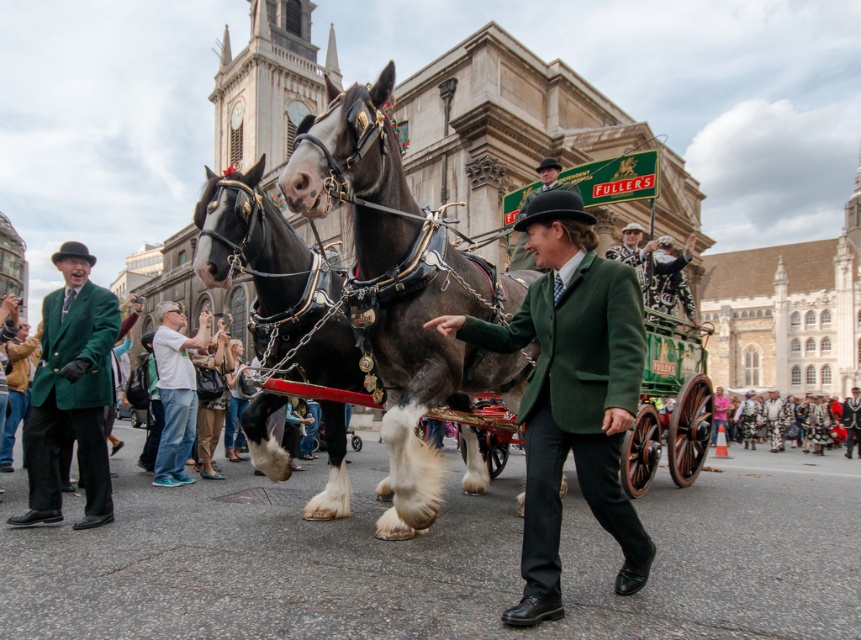
Question: From the image, what is the correct spatial relationship of green velvet jacket at center in relation to green woolen blazer at left?

Choices:
 (A) left
 (B) right

Answer: (B)

Question: In this image, where is green woolen blazer at left located relative to green woolen coat at center?

Choices:
 (A) above
 (B) below

Answer: (B)

Question: Which object is the closest to the floral-patterned fabric at lower right?

Choices:
 (A) green woolen coat at center
 (B) green woolen blazer at left

Answer: (A)

Question: Which object is farther from the camera taking this photo?

Choices:
 (A) green woolen blazer at left
 (B) blue jeans at center

Answer: (B)

Question: Does shiny dark brown horse at center appear on the right side of floral-patterned fabric at lower right?

Choices:
 (A) yes
 (B) no

Answer: (B)

Question: Which object is closer to the camera taking this photo?

Choices:
 (A) shiny polished wood horse cart at center
 (B) floral-patterned fabric at lower right
 (C) shiny dark brown horse at center
 (D) blue jeans at center

Answer: (A)